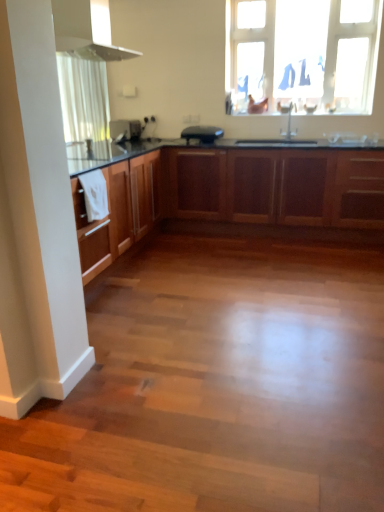
Question: From the image's perspective, is transparent plastic window at upper center beneath wooden cabinets at center?

Choices:
 (A) yes
 (B) no

Answer: (B)

Question: Is transparent plastic window at upper center thinner than wooden cabinets at center?

Choices:
 (A) yes
 (B) no

Answer: (A)

Question: From the image's perspective, is transparent plastic window at upper center on top of wooden cabinets at center?

Choices:
 (A) yes
 (B) no

Answer: (A)

Question: Would you say transparent plastic window at upper center is outside wooden cabinets at center?

Choices:
 (A) yes
 (B) no

Answer: (A)

Question: Considering the relative sizes of transparent plastic window at upper center and wooden cabinets at center in the image provided, is transparent plastic window at upper center bigger than wooden cabinets at center?

Choices:
 (A) no
 (B) yes

Answer: (A)

Question: Is wooden cabinets at center at the back of transparent plastic window at upper center?

Choices:
 (A) yes
 (B) no

Answer: (B)

Question: Considering the relative positions of black matte toaster at center, the 2th appliance positioned from the left, and satin black toaster at center, which is the second appliance in right-to-left order, in the image provided, is black matte toaster at center, the 2th appliance positioned from the left, behind satin black toaster at center, which is the second appliance in right-to-left order,?

Choices:
 (A) yes
 (B) no

Answer: (B)

Question: Considering the relative sizes of black matte toaster at center, placed as the first appliance when sorted from right to left, and satin black toaster at center, which is the second appliance in right-to-left order, in the image provided, is black matte toaster at center, placed as the first appliance when sorted from right to left, bigger than satin black toaster at center, which is the second appliance in right-to-left order,?

Choices:
 (A) no
 (B) yes

Answer: (B)

Question: From a real-world perspective, is black matte toaster at center, placed as the first appliance when sorted from right to left, positioned over satin black toaster at center, which is the second appliance in right-to-left order, based on gravity?

Choices:
 (A) no
 (B) yes

Answer: (A)

Question: Would you say black matte toaster at center, the 2th appliance positioned from the left, is outside satin black toaster at center, the 1th appliance viewed from the left?

Choices:
 (A) yes
 (B) no

Answer: (A)

Question: Is black matte toaster at center, the 2th appliance positioned from the left, wider than satin black toaster at center, which is the second appliance in right-to-left order?

Choices:
 (A) no
 (B) yes

Answer: (B)

Question: Could you tell me if black matte toaster at center, the 2th appliance positioned from the left, is turned towards satin black toaster at center, which is the second appliance in right-to-left order?

Choices:
 (A) no
 (B) yes

Answer: (A)

Question: From a real-world perspective, is black matte toaster at center, the 2th appliance positioned from the left, on transparent plastic window at upper center?

Choices:
 (A) no
 (B) yes

Answer: (A)